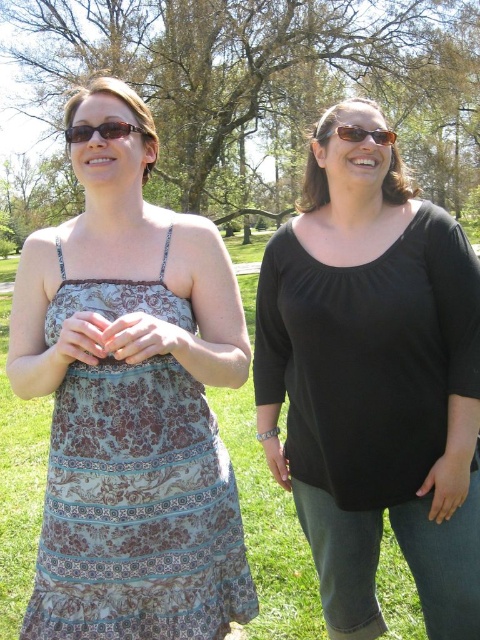
Does black matte top at center lie behind matte brown sunglasses at upper center?

That is False.

Is black matte top at center above matte brown sunglasses at upper center?

No, black matte top at center is not above matte brown sunglasses at upper center.

In order to click on black matte top at center in this screenshot , I will do `click(373, 381)`.

In order to click on black matte top at center in this screenshot , I will do `click(373, 381)`.

Does printed fabric dress at center have a larger size compared to matte brown sunglasses at upper center?

Indeed, printed fabric dress at center has a larger size compared to matte brown sunglasses at upper center.

Is point (119, 516) farther from viewer compared to point (395, 140)?

No.

Find the location of a particular element. printed fabric dress at center is located at coordinates (137, 512).

Does point (90, 131) come in front of point (343, 138)?

That is True.

Is matte black sunglasses at upper left thinner than matte brown sunglasses at upper center?

No, matte black sunglasses at upper left is not thinner than matte brown sunglasses at upper center.

Who is more forward, [139,131] or [354,134]?

Point [139,131]

Where is `matte black sunglasses at upper left`? This screenshot has width=480, height=640. matte black sunglasses at upper left is located at coordinates (103, 131).